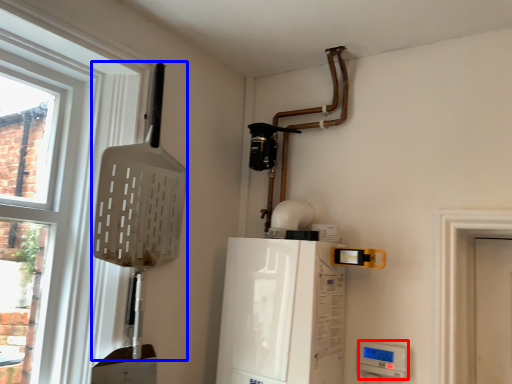
Question: Which point is closer to the camera, appliance (highlighted by a red box) or shovel (highlighted by a blue box)?

Choices:
 (A) appliance
 (B) shovel

Answer: (B)